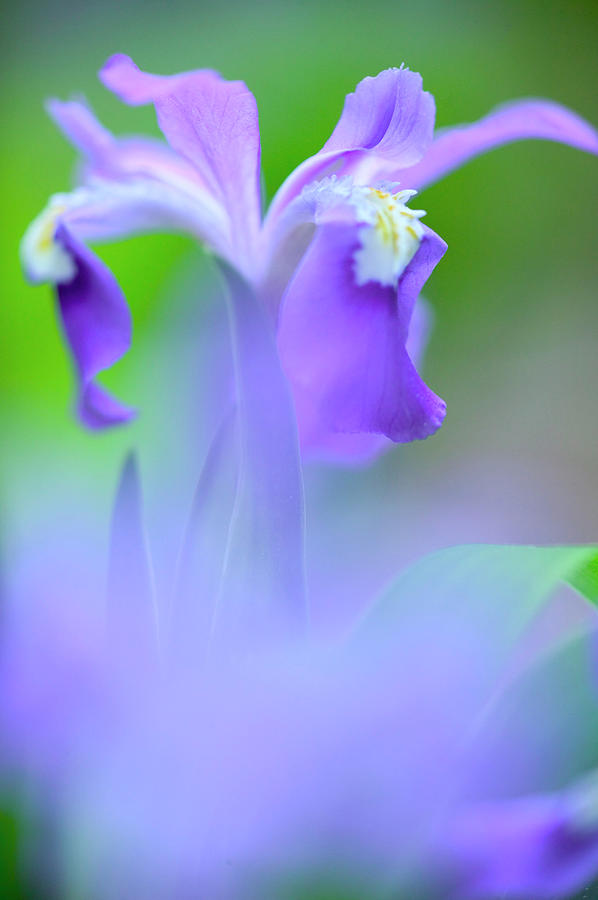
You are a GUI agent. You are given a task and a screenshot of the screen. Output one action in this format:
    pyautogui.click(x=<x>, y=<y>)
    Task: Click on the blue shade
    
    Given the screenshot: What is the action you would take?
    pyautogui.click(x=295, y=749)